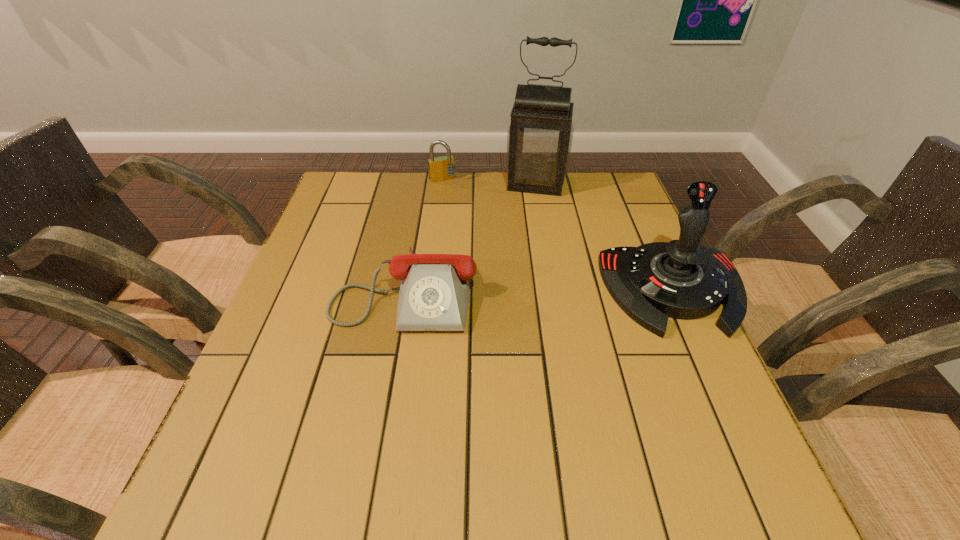
You are a GUI agent. You are given a task and a screenshot of the screen. Output one action in this format:
    pyautogui.click(x=<x>, y=<y>)
    Task: Click on the free space located 0.250m on the front-facing side of the third object from left to right
    
    Given the screenshot: What is the action you would take?
    pyautogui.click(x=522, y=249)

Where is `free region located on the side with the combination dials of the padlock`? This screenshot has height=540, width=960. free region located on the side with the combination dials of the padlock is located at coordinates (470, 224).

I want to click on free region located 0.170m on the side with the combination dials of the padlock, so click(x=465, y=213).

Identify the location of vacant space located 0.350m on the side with the combination dials of the padlock. This screenshot has height=540, width=960. (488, 252).

In order to click on lantern that is at the far edge in this screenshot , I will do point(539,138).

Locate an element on the screen. This screenshot has height=540, width=960. padlock that is at the far edge is located at coordinates (442, 168).

Locate an element on the screen. The width and height of the screenshot is (960, 540). object present at the left edge is located at coordinates pyautogui.click(x=434, y=293).

Where is `object at the right edge`? This screenshot has width=960, height=540. object at the right edge is located at coordinates (683, 279).

I want to click on vacant space at the far edge of the desktop, so click(x=434, y=189).

This screenshot has height=540, width=960. I want to click on vacant area at the near edge, so click(397, 402).